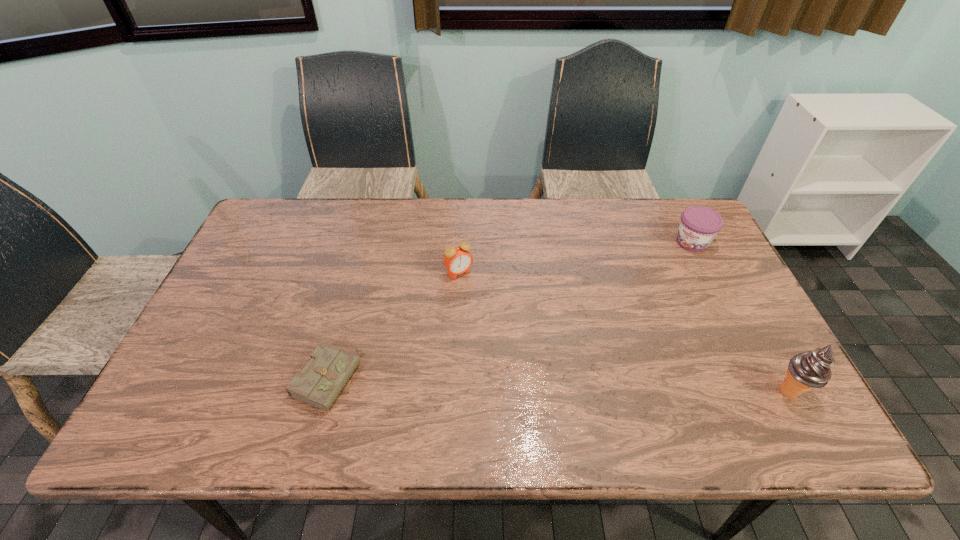
Locate an element on the screen. free spot between the jam and the second farthest object is located at coordinates (576, 257).

Locate an element on the screen. The width and height of the screenshot is (960, 540). free spot between the diary and the alarm clock is located at coordinates (394, 326).

Identify the location of empty space between the alarm clock and the jam. Image resolution: width=960 pixels, height=540 pixels. (576, 257).

This screenshot has width=960, height=540. Find the location of `vacant region between the tallest object and the alarm clock`. vacant region between the tallest object and the alarm clock is located at coordinates (624, 332).

Locate an element on the screen. empty space between the second object from left to right and the leftmost object is located at coordinates (394, 326).

The image size is (960, 540). Identify the location of free space between the third nearest object and the farthest object. (576, 257).

Locate an element on the screen. blank region between the jam and the third object from right to left is located at coordinates (576, 257).

Find the location of a particular element. The height and width of the screenshot is (540, 960). object that stands as the third closest to the tallest object is located at coordinates (321, 381).

Locate an element on the screen. Image resolution: width=960 pixels, height=540 pixels. object that is the third closest to the third nearest object is located at coordinates (807, 370).

The image size is (960, 540). Find the location of `free location that satisfies the following two spatial constraints: 1. on the front side of the icecream; 2. on the left side of the diary`. free location that satisfies the following two spatial constraints: 1. on the front side of the icecream; 2. on the left side of the diary is located at coordinates (324, 391).